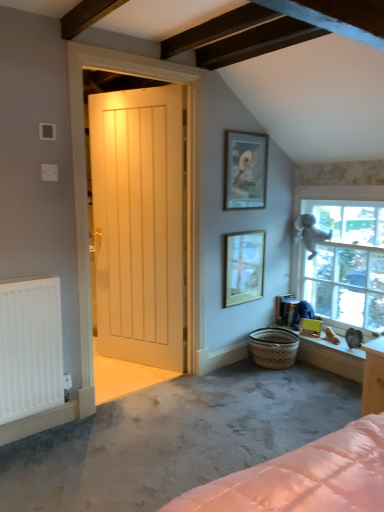
Question: Would you consider matte glass picture frame at center, positioned as the 2th picture frame in left-to-right order, to be distant from smooth white window sill at lower right?

Choices:
 (A) yes
 (B) no

Answer: (B)

Question: From a real-world perspective, is matte glass picture frame at center, acting as the second picture frame starting from the top, below smooth white window sill at lower right?

Choices:
 (A) no
 (B) yes

Answer: (A)

Question: From a real-world perspective, is matte glass picture frame at center, positioned as the 2th picture frame in left-to-right order, over smooth white window sill at lower right?

Choices:
 (A) no
 (B) yes

Answer: (B)

Question: Can you confirm if matte glass picture frame at center, acting as the second picture frame starting from the top, is positioned to the right of smooth white window sill at lower right?

Choices:
 (A) no
 (B) yes

Answer: (A)

Question: Is matte glass picture frame at center, positioned as the 2th picture frame in left-to-right order, positioned in front of smooth white window sill at lower right?

Choices:
 (A) no
 (B) yes

Answer: (A)

Question: Based on their sizes in the image, would you say white wooden door at center is bigger or smaller than gray carpet at lower left?

Choices:
 (A) big
 (B) small

Answer: (B)

Question: In the image, is white wooden door at center positioned in front of or behind gray carpet at lower left?

Choices:
 (A) behind
 (B) front

Answer: (A)

Question: Do you think white wooden door at center is within gray carpet at lower left, or outside of it?

Choices:
 (A) outside
 (B) inside

Answer: (A)

Question: From a real-world perspective, is white wooden door at center positioned above or below gray carpet at lower left?

Choices:
 (A) below
 (B) above

Answer: (B)

Question: Considering the positions of green matte picture frame at lower right, the third picture frame in the top-to-bottom sequence, and white matte radiator at lower left in the image, is green matte picture frame at lower right, the third picture frame in the top-to-bottom sequence, bigger or smaller than white matte radiator at lower left?

Choices:
 (A) small
 (B) big

Answer: (A)

Question: From the image's perspective, relative to white matte radiator at lower left, is green matte picture frame at lower right, which ranks as the first picture frame in right-to-left order, above or below?

Choices:
 (A) above
 (B) below

Answer: (B)

Question: In terms of height, does green matte picture frame at lower right, which ranks as the first picture frame in right-to-left order, look taller or shorter compared to white matte radiator at lower left?

Choices:
 (A) short
 (B) tall

Answer: (A)

Question: Is green matte picture frame at lower right, which is the 1th picture frame in bottom-to-top order, in front of or behind white matte radiator at lower left in the image?

Choices:
 (A) front
 (B) behind

Answer: (B)

Question: Relative to white wooden door at center, is white matte radiator at lower left in front or behind?

Choices:
 (A) behind
 (B) front

Answer: (B)

Question: Does point (11, 315) appear closer or farther from the camera than point (140, 321)?

Choices:
 (A) farther
 (B) closer

Answer: (B)